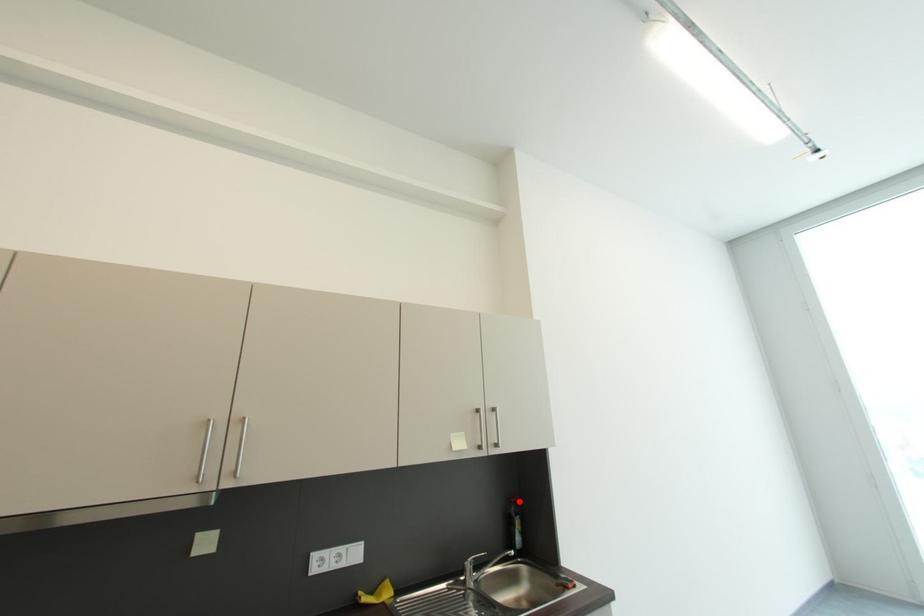
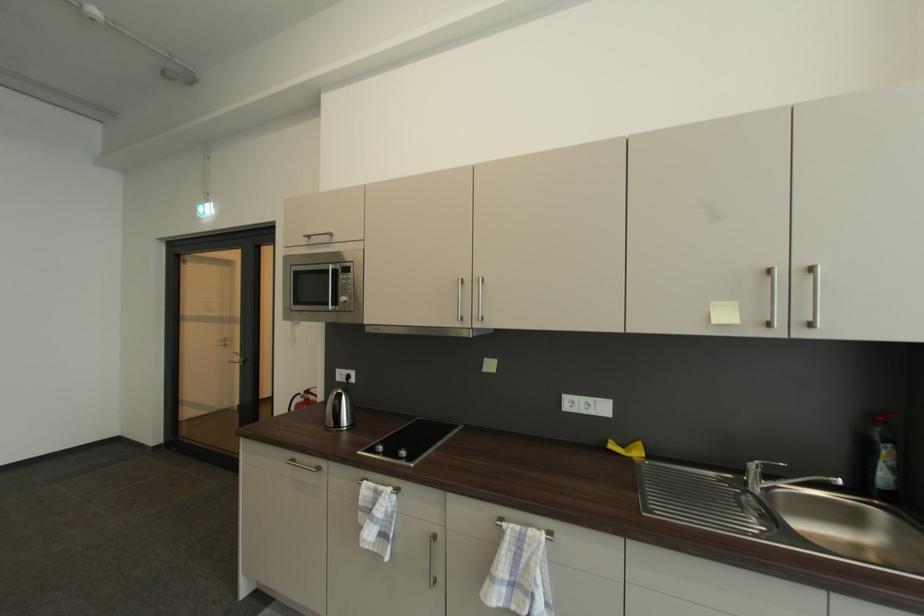
Locate, in the second image, the point that corresponds to the highlighted location in the first image.

(885, 419)